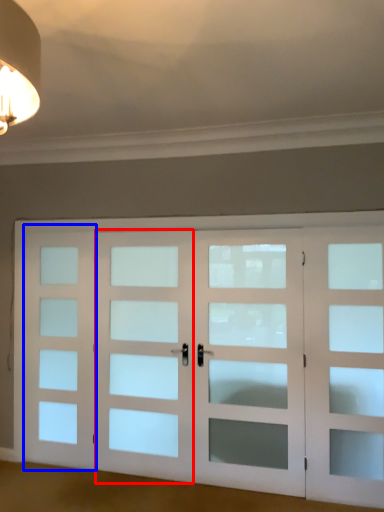
Question: Which of the following is the closest to the observer, screen door (highlighted by a red box) or screen door (highlighted by a blue box)?

Choices:
 (A) screen door
 (B) screen door

Answer: (A)